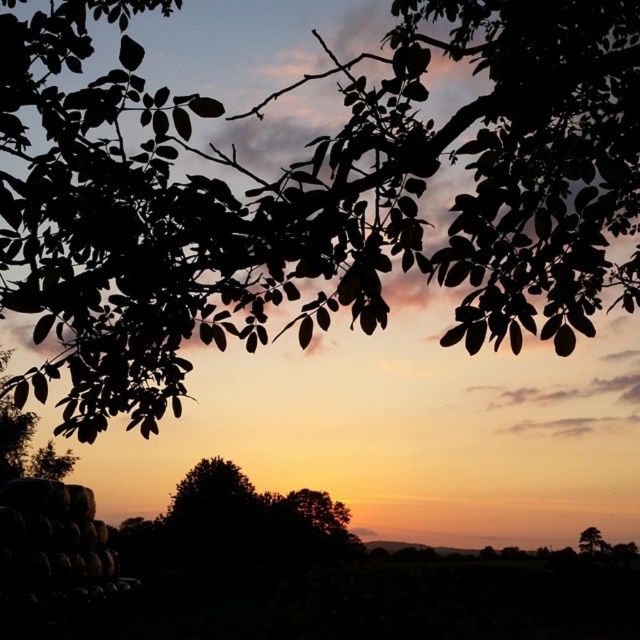
From the picture: Is black leafy branch at upper center positioned before green matte tree at upper right?

Yes, black leafy branch at upper center is closer to the viewer.

Is black leafy branch at upper center below green matte tree at upper right?

Incorrect, black leafy branch at upper center is not positioned below green matte tree at upper right.

Who is more distant from viewer, (544, 168) or (595, 531)?

The point (595, 531) is more distant.

Image resolution: width=640 pixels, height=640 pixels. Identify the location of black leafy branch at upper center. (316, 196).